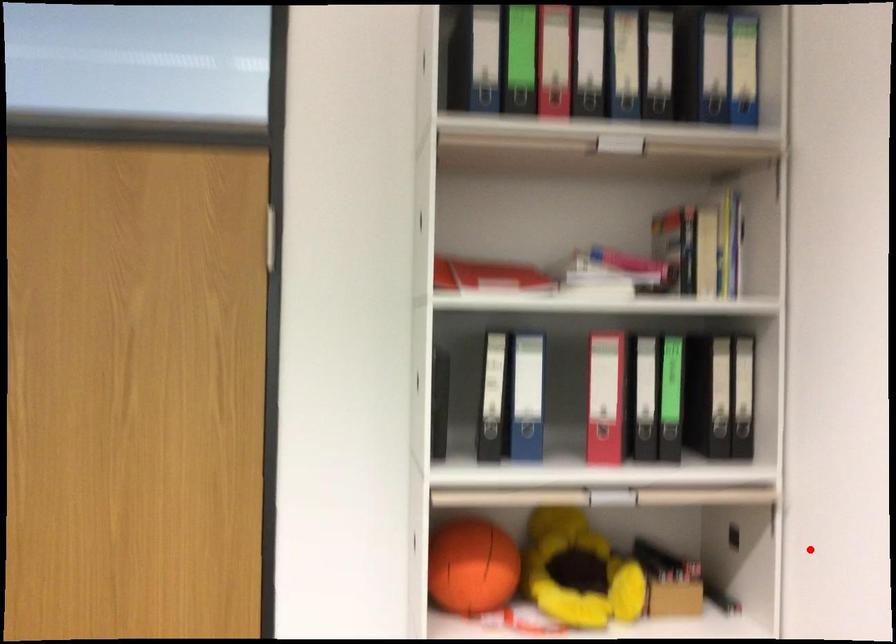
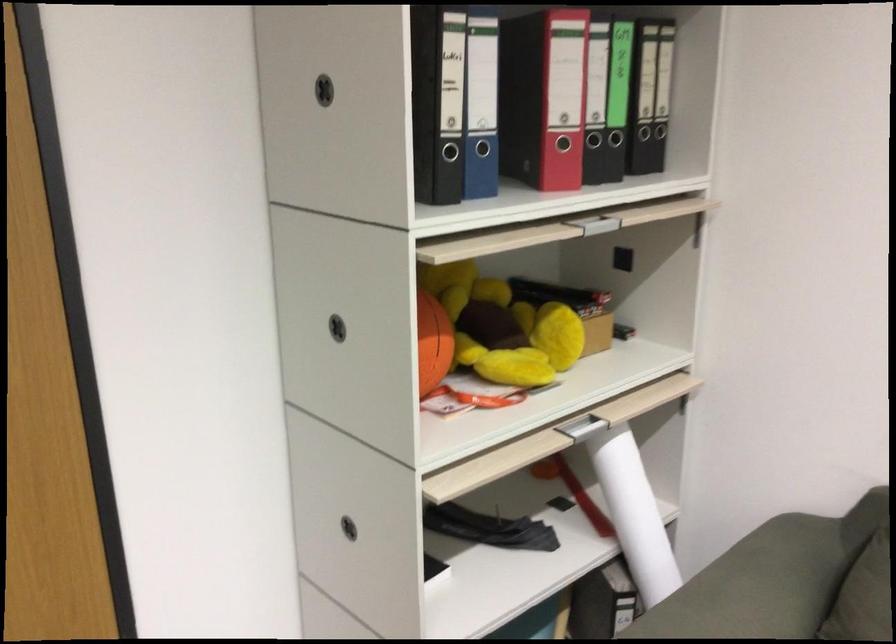
Locate, in the second image, the point that corresponds to the highlighted location in the first image.

(743, 260)